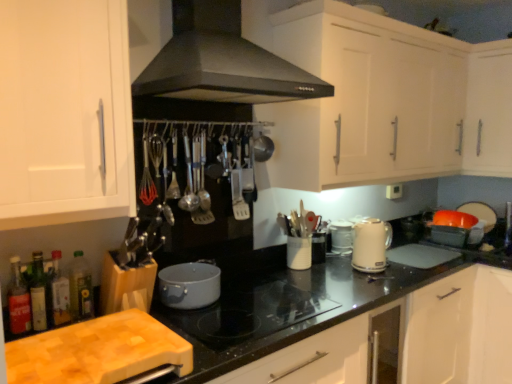
The image size is (512, 384). I want to click on vacant area in front of beige glossy electric kettle at right, so click(x=395, y=273).